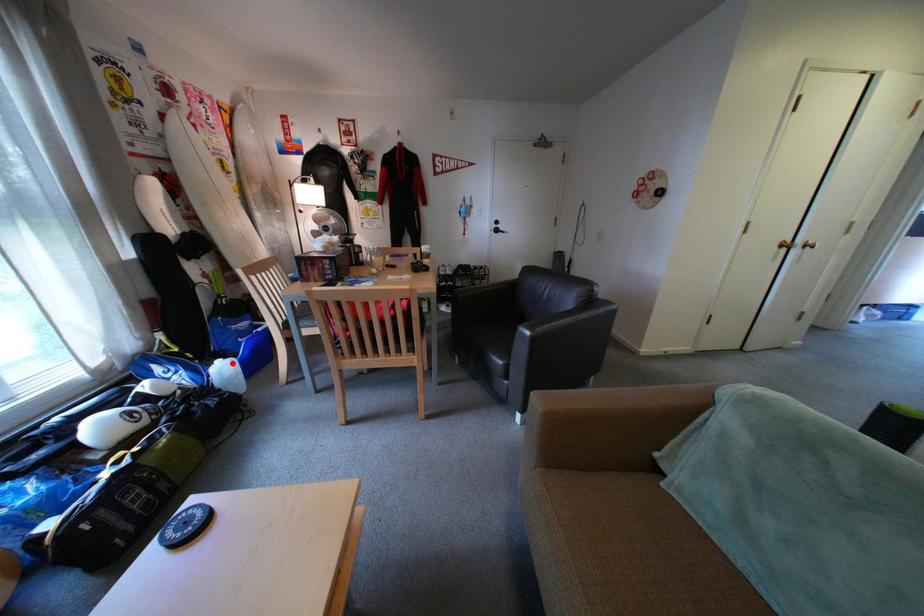
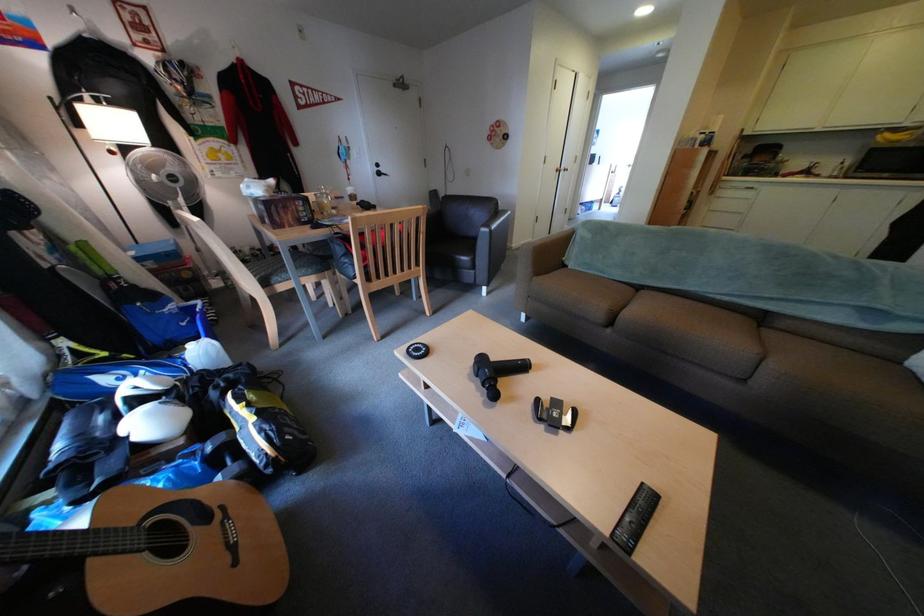
Find the pixel in the second image that matches the highlighted location in the first image.

(204, 347)